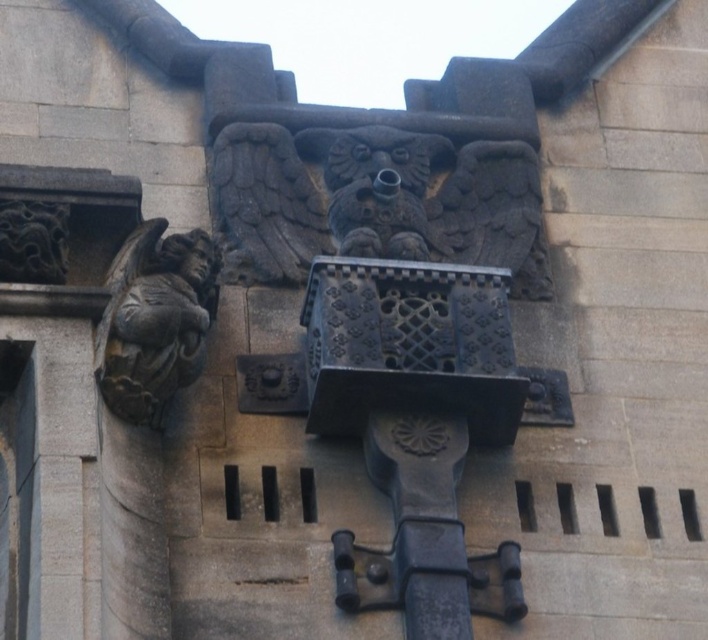
You are an architect examining the stone carvings on a historical building. You notice the dark gray stone gargoyle at left and the black stone dragon at upper left. Which of these two carvings is located to the right of the other?

The dark gray stone gargoyle at left is positioned on the right side of the black stone dragon at upper left, so the gargoyle is to the right of the dragon.

You are an architect examining the stone structure. You need to determine the spatial relationship between the dark gray stone gargoyle at left and the carved stone relief of the mythical creature. Based on their positions, which object is closer to the center of the structure?

The dark gray stone gargoyle at left is located at point (154, 317), while the carved stone relief of the mythical creature is centrally positioned. Since the gargoyle is at the left side, the mythical creature relief is closer to the center of the structure.

You are an art conservator examining the stone carvings in this historical building. You need to clean both the dark gray stone gargoyle at left and the black stone dragon at upper left. Which one should you clean first if you want to start with the one that is higher up?

The black stone dragon at upper left should be cleaned first because it is positioned above the dark gray stone gargoyle at left.